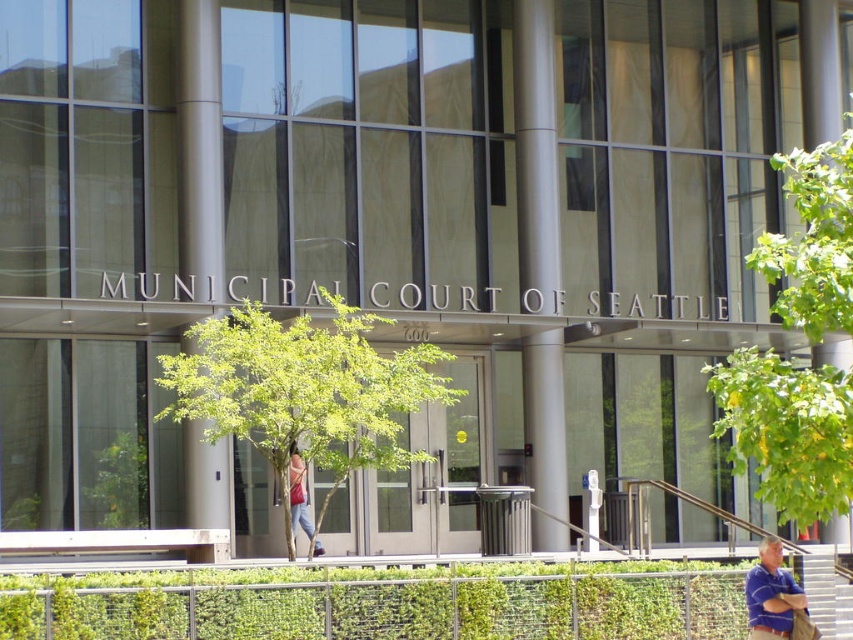
You are a visitor approaching the Municipal Court of Seattle building and see the green leafy hedge at lower center and the white plastic stairs at lower right. Which object is closer to the entrance of the building?

The green leafy hedge at lower center is closer to the entrance of the building since it is positioned to the left of the white plastic stairs at lower right, which are further to the right.